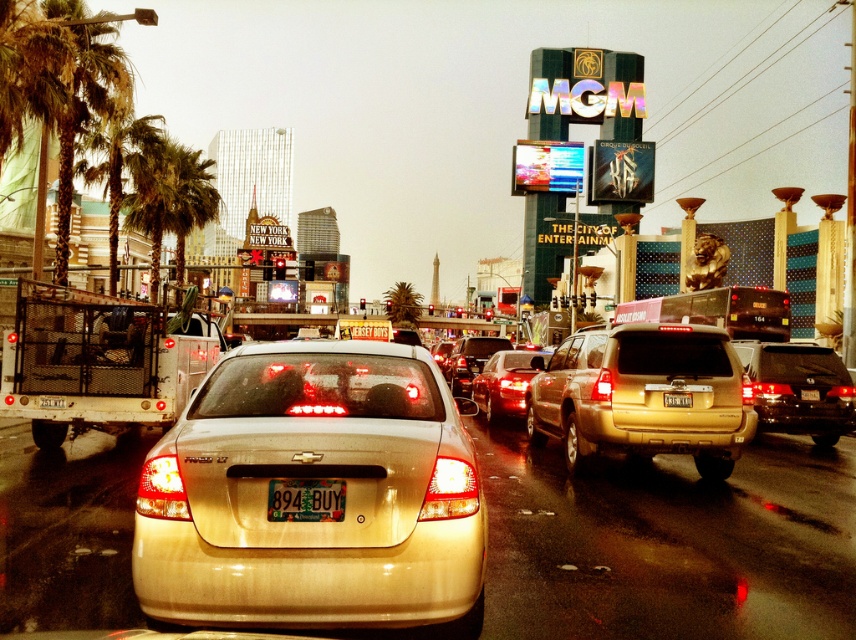
You are a driver in Las Vegas and want to know if the shiny gold suv at right is parked under the green plastic license plate at center. Can you confirm this based on the scene?

The shiny gold suv at right is positioned under green plastic license plate at center, so yes, the shiny gold suv at right is parked under the green plastic license plate at center.

You are a pedestrian standing on the sidewalk next to the metallic gold sedan at center. You want to take a photo of the green leafy palm tree at left without moving. Is the palm tree visible in your current position?

The metallic gold sedan at center is in front of the green leafy palm tree at left, so the palm tree may be partially or fully blocked by the sedan depending on its size and distance. However, since the sedan is at the center and the palm tree is at the left, there might be an angle where the palm tree is still visible around the sedan.